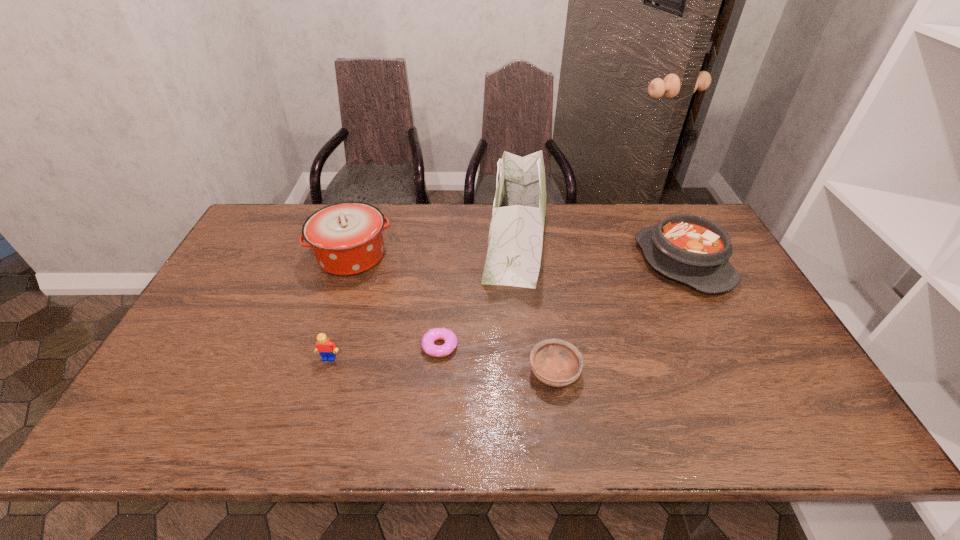
This screenshot has width=960, height=540. I want to click on free space located 0.330m on the right of the fifth shortest object, so click(496, 255).

The height and width of the screenshot is (540, 960). I want to click on blank area located 0.320m on the left of the shorter casserole, so click(x=537, y=262).

This screenshot has height=540, width=960. In order to click on vacant space located on the face of the fourth tallest object in this screenshot , I will do `click(320, 390)`.

Locate an element on the screen. This screenshot has height=540, width=960. free location located on the right of the fifth tallest object is located at coordinates (729, 372).

The image size is (960, 540). In order to click on blank area located on the back of the third object from left to right in this screenshot , I will do `click(443, 316)`.

This screenshot has height=540, width=960. Find the location of `grocery bag at the far edge`. grocery bag at the far edge is located at coordinates (515, 242).

Locate an element on the screen. object at the right edge is located at coordinates (694, 250).

Where is `object positioned at the far right corner`? The image size is (960, 540). object positioned at the far right corner is located at coordinates (694, 250).

Find the location of a particular element. The image size is (960, 540). vacant space at the far edge of the desktop is located at coordinates (465, 207).

You are a GUI agent. You are given a task and a screenshot of the screen. Output one action in this format:
    pyautogui.click(x=<x>, y=<y>)
    Task: Click on the vacant area at the near edge of the desktop
    
    Given the screenshot: What is the action you would take?
    pyautogui.click(x=711, y=409)